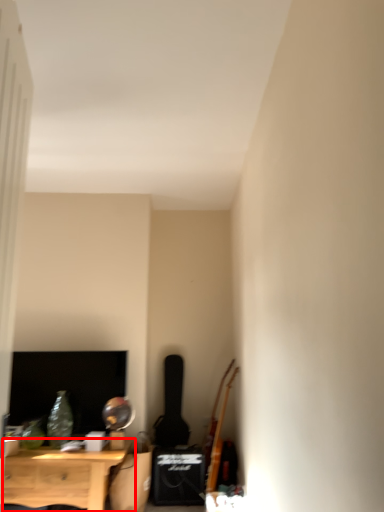
Question: Considering the relative positions of nightstand (annotated by the red box) and instrument in the image provided, where is nightstand (annotated by the red box) located with respect to the staircase?

Choices:
 (A) left
 (B) right

Answer: (A)